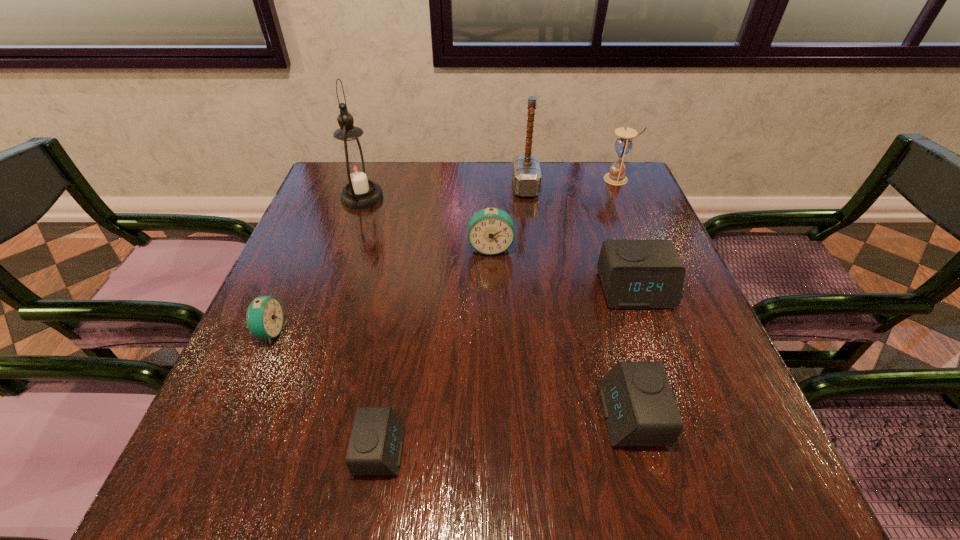
I want to click on oil lamp that is at the left edge, so click(355, 168).

You are a GUI agent. You are given a task and a screenshot of the screen. Output one action in this format:
    pyautogui.click(x=<x>, y=<y>)
    Task: Click on the alarm clock present at the left edge
    This screenshot has height=540, width=960.
    Given the screenshot: What is the action you would take?
    pyautogui.click(x=264, y=317)

You are a GUI agent. You are given a task and a screenshot of the screen. Output one action in this format:
    pyautogui.click(x=<x>, y=<y>)
    Task: Click on the hourglass present at the right edge
    This screenshot has width=960, height=540.
    Given the screenshot: What is the action you would take?
    pyautogui.click(x=623, y=144)

Locate an element on the screen. This screenshot has height=540, width=960. object that is at the far left corner is located at coordinates (355, 168).

At what (x,y) coordinates should I click in order to perform the action: click on object that is at the far right corner. Please return your answer as a coordinate pair (x, y). This screenshot has width=960, height=540. Looking at the image, I should click on (623, 144).

In order to click on object that is at the near right corner in this screenshot , I will do `click(639, 407)`.

You are a GUI agent. You are given a task and a screenshot of the screen. Output one action in this format:
    pyautogui.click(x=<x>, y=<y>)
    Task: Click on the free space at the far edge of the desktop
    
    Given the screenshot: What is the action you would take?
    pyautogui.click(x=396, y=202)

In the image, there is a desktop. In order to click on vacant region at the left edge in this screenshot , I will do `click(335, 263)`.

Image resolution: width=960 pixels, height=540 pixels. I want to click on free space at the right edge of the desktop, so click(708, 348).

I want to click on vacant area at the near left corner, so click(286, 482).